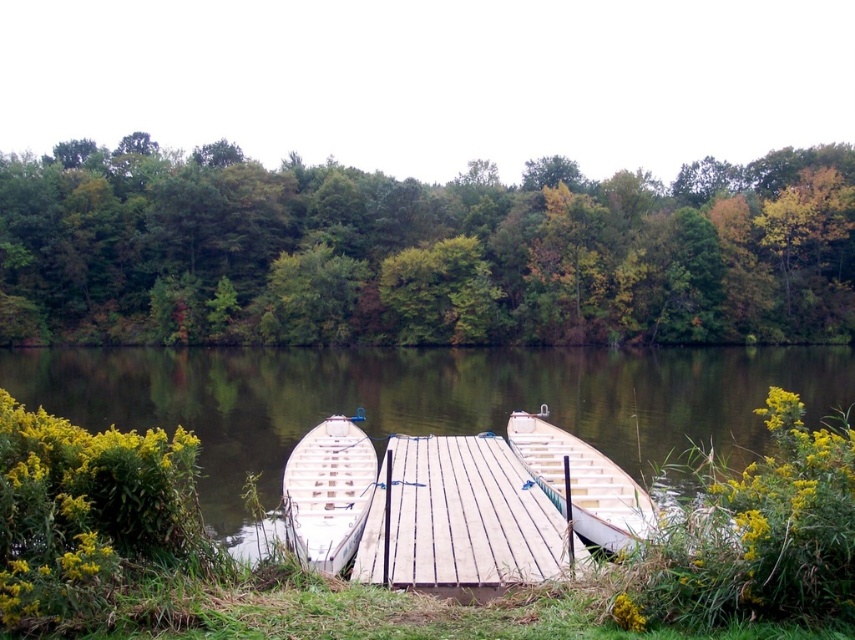
Does clear water at center appear on the right side of white wood boat at left?

In fact, clear water at center is to the left of white wood boat at left.

Can you confirm if clear water at center is positioned below white wood boat at left?

No.

This screenshot has height=640, width=855. Find the location of `clear water at center`. clear water at center is located at coordinates (426, 401).

Find the location of a particular element. clear water at center is located at coordinates (426, 401).

Which of these two, green leafy trees at upper center or white wood boat at left, stands shorter?

Standing shorter between the two is white wood boat at left.

Does point (332, 307) come behind point (352, 515)?

Yes, point (332, 307) is farther from viewer.

You are a GUI agent. You are given a task and a screenshot of the screen. Output one action in this format:
    pyautogui.click(x=<x>, y=<y>)
    Task: Click on the green leafy trees at upper center
    The image size is (855, 640).
    Given the screenshot: What is the action you would take?
    pyautogui.click(x=420, y=250)

Does point (323, 360) lie behind point (500, 577)?

Yes.

Is point (407, 428) less distant than point (469, 566)?

That is False.

I want to click on clear water at center, so click(x=426, y=401).